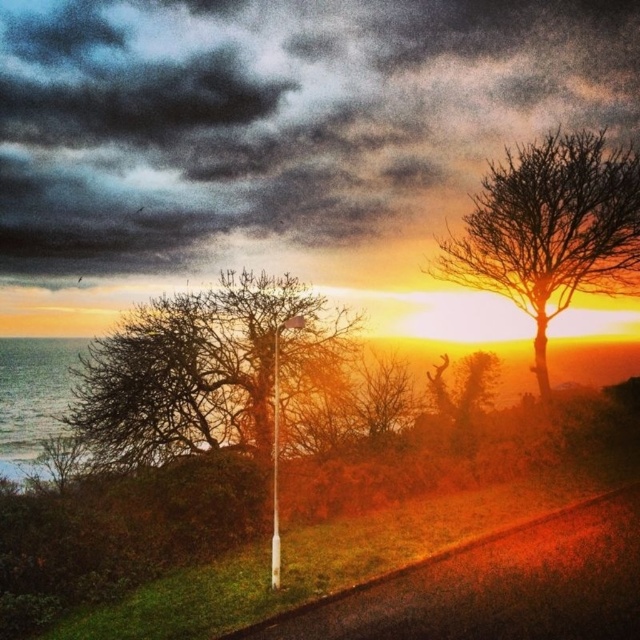
Question: Which point is closer to the camera?

Choices:
 (A) bare branches at upper right
 (B) bare branches at left

Answer: (B)

Question: In this image, where is bare branches at left located relative to bare branches at upper right?

Choices:
 (A) above
 (B) below

Answer: (B)

Question: Is bare branches at left below bare branches at upper right?

Choices:
 (A) yes
 (B) no

Answer: (A)

Question: Which of the following is the closest to the observer?

Choices:
 (A) bare branches at upper right
 (B) bare branches at left

Answer: (B)

Question: Is bare branches at left smaller than bare branches at upper right?

Choices:
 (A) yes
 (B) no

Answer: (A)

Question: Which object appears farthest from the camera in this image?

Choices:
 (A) bare branches at left
 (B) bare branches at upper right

Answer: (B)